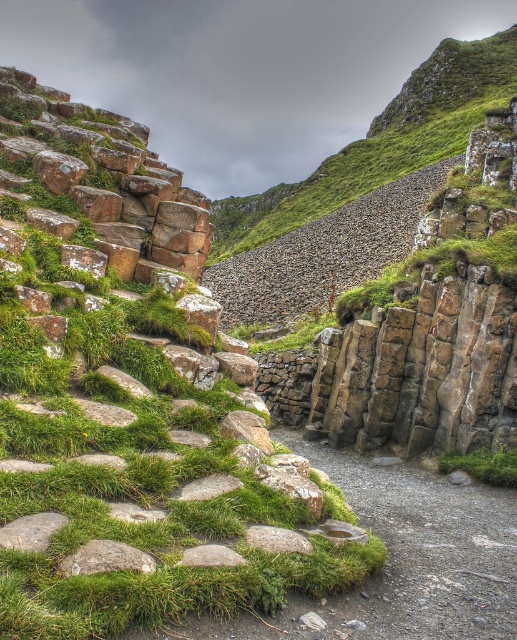
Question: Is green mossy rock at upper center to the left of green grass at lower center from the viewer's perspective?

Choices:
 (A) no
 (B) yes

Answer: (A)

Question: Can you confirm if green mossy rock at left is positioned to the right of green grass at lower center?

Choices:
 (A) yes
 (B) no

Answer: (B)

Question: Does green mossy rock at left appear under green grass at lower center?

Choices:
 (A) no
 (B) yes

Answer: (A)

Question: Considering the real-world distances, which object is farthest from the green mossy rock at upper center?

Choices:
 (A) green mossy rock at left
 (B) green grass at lower center
 (C) green mossy stone path at center

Answer: (B)

Question: Which point is closer to the camera?

Choices:
 (A) (296, 440)
 (B) (473, 470)
 (C) (409, 170)

Answer: (B)

Question: Estimate the real-world distances between objects in this image. Which object is farther from the green mossy rock at upper center?

Choices:
 (A) green mossy rock at left
 (B) green mossy stone path at center

Answer: (B)